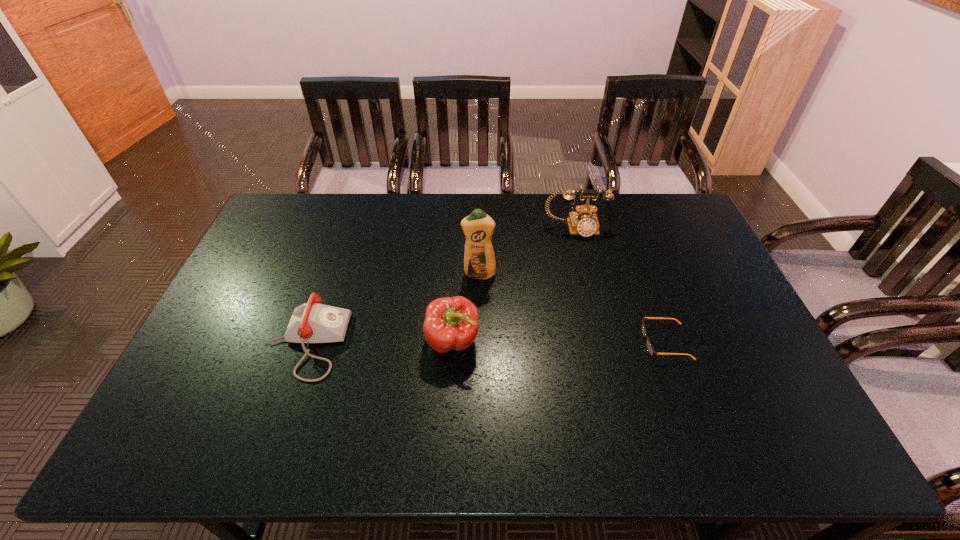
Image resolution: width=960 pixels, height=540 pixels. In the image, there is a desktop. What are the coordinates of `vacant space at the far right corner` in the screenshot? It's located at (657, 227).

Where is `free space that is in between the shorter telephone and the shortest object`? Image resolution: width=960 pixels, height=540 pixels. free space that is in between the shorter telephone and the shortest object is located at coordinates (486, 342).

In order to click on empty space between the fourth nearest object and the nearer telephone in this screenshot , I will do `click(393, 309)`.

Where is `vacant area that lies between the spectacles and the nearer telephone`? This screenshot has height=540, width=960. vacant area that lies between the spectacles and the nearer telephone is located at coordinates (486, 342).

At what (x,y) coordinates should I click in order to perform the action: click on free space between the taller telephone and the pepper. Please return your answer as a coordinate pair (x, y). This screenshot has width=960, height=540. Looking at the image, I should click on (515, 286).

You are a GUI agent. You are given a task and a screenshot of the screen. Output one action in this format:
    pyautogui.click(x=<x>, y=<y>)
    Task: Click on the free space that is in between the shortest object and the pepper
    The height and width of the screenshot is (540, 960).
    Given the screenshot: What is the action you would take?
    pyautogui.click(x=559, y=342)

The width and height of the screenshot is (960, 540). I want to click on unoccupied position between the left telephone and the pepper, so click(x=380, y=342).

This screenshot has width=960, height=540. I want to click on vacant area that lies between the pepper and the right telephone, so click(515, 286).

Where is `free point between the shortest object and the shorter telephone`? The height and width of the screenshot is (540, 960). free point between the shortest object and the shorter telephone is located at coordinates (486, 342).

The width and height of the screenshot is (960, 540). I want to click on free space that is in between the pepper and the spectacles, so click(559, 342).